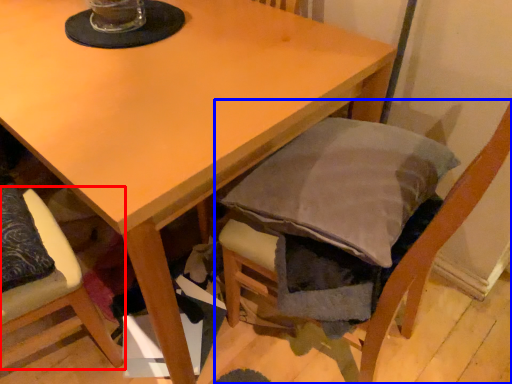
Question: Which object is closer to the camera taking this photo, chair (highlighted by a red box) or chair (highlighted by a blue box)?

Choices:
 (A) chair
 (B) chair

Answer: (B)